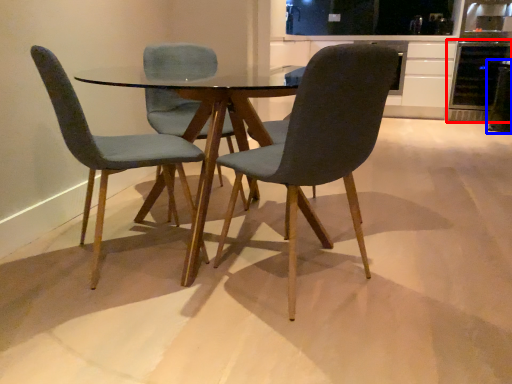
Question: Which point is closer to the camera, appliance (highlighted by a red box) or appliance (highlighted by a blue box)?

Choices:
 (A) appliance
 (B) appliance

Answer: (B)